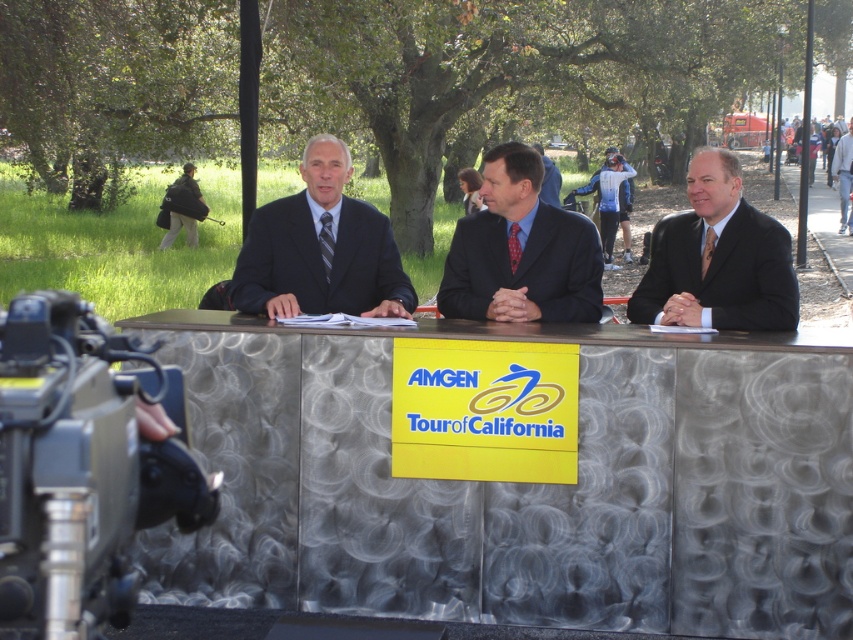
Can you confirm if metallic textured table at center is positioned above matte black suit at center?

No, metallic textured table at center is not above matte black suit at center.

How far apart are metallic textured table at center and matte black suit at center?

The distance of metallic textured table at center from matte black suit at center is 32.26 inches.

Find the location of a particular element. The height and width of the screenshot is (640, 853). metallic textured table at center is located at coordinates (521, 484).

Describe the element at coordinates (520, 250) in the screenshot. I see `dark suit at center` at that location.

Is point (518, 308) less distant than point (849, 209)?

Yes, point (518, 308) is in front of point (849, 209).

Image resolution: width=853 pixels, height=640 pixels. In order to click on dark suit at center in this screenshot , I will do `click(520, 250)`.

Which of these two, matte black suit at center or gray suit at center, stands taller?

With more height is gray suit at center.

Describe the element at coordinates (320, 248) in the screenshot. I see `matte black suit at center` at that location.

Between point (303, 150) and point (851, 172), which one is positioned in front?

Positioned in front is point (303, 150).

Locate an element on the screen. matte black suit at center is located at coordinates (320, 248).